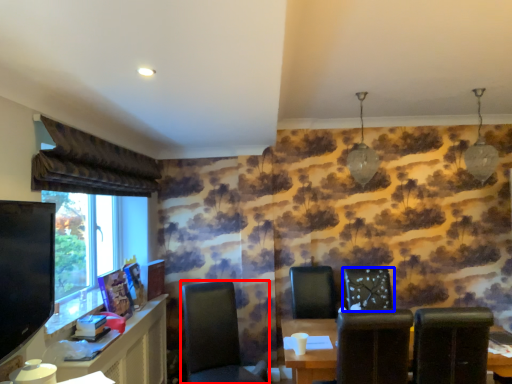
Question: Which object is closer to the camera taking this photo, chair (highlighted by a red box) or chair (highlighted by a blue box)?

Choices:
 (A) chair
 (B) chair

Answer: (A)